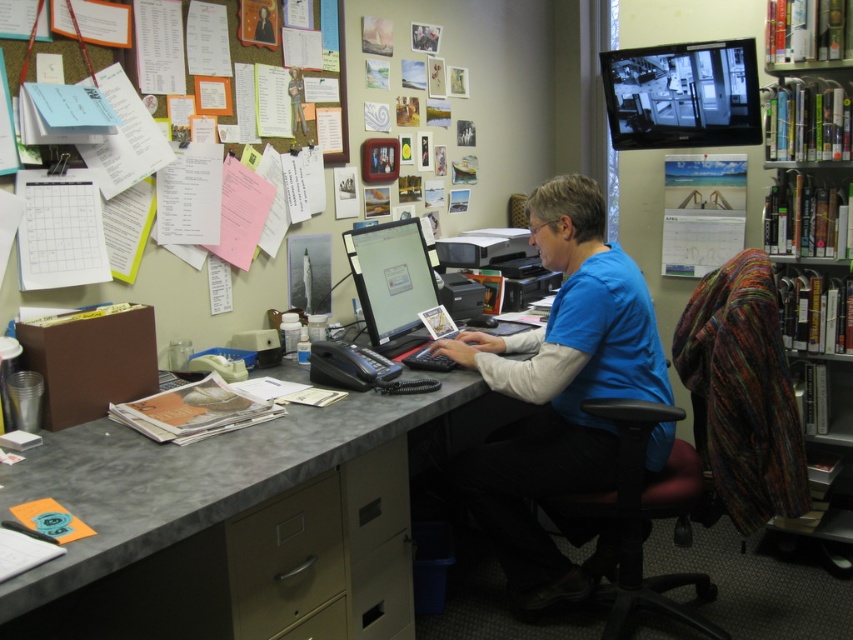
What are the coordinates of the gray laminate desk at center?

The gray laminate desk at center is located at coordinates point (241,520).

You are an office assistant who needs to locate the blue cotton shirt at center and the black glossy monitor at upper right. From the perspective of someone sitting at the desk, which object is closer to the left side?

The blue cotton shirt at center is positioned on the left side of the black glossy monitor at upper right, so from the perspective of someone sitting at the desk, the blue cotton shirt at center is closer to the left side.

Based on the photo, you are an office worker who needs to adjust the height of your computer monitor. The monitor is placed on the gray laminate desk at center. Considering the height of the blue cotton shirt at center, would you need to raise or lower the monitor to achieve a proper ergonomic setup?

The gray laminate desk at center is not as tall as the blue cotton shirt at center, so to achieve a proper ergonomic setup, you should raise the monitor to ensure it is at eye level with the blue cotton shirt at center.